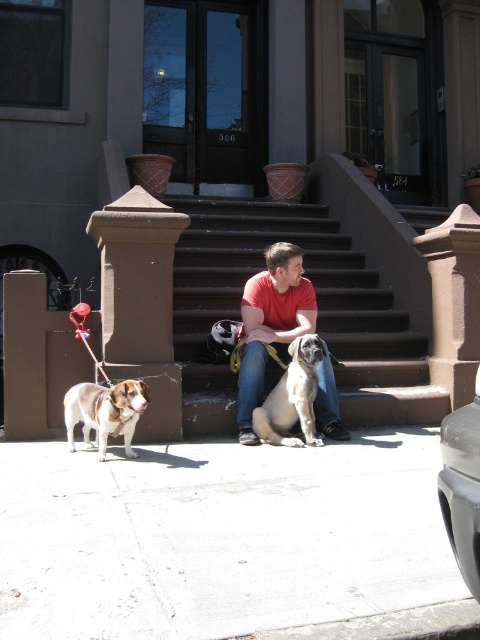
Who is taller, white concrete pavement at lower center or smooth gray dog at center?

smooth gray dog at center

Which is above, white concrete pavement at lower center or smooth gray dog at center?

smooth gray dog at center is above.

Is point (0, 616) in front of point (292, 388)?

Yes.

At what (x,y) coordinates should I click in order to perform the action: click on white concrete pavement at lower center. Please return your answer as a coordinate pair (x, y). Image resolution: width=480 pixels, height=640 pixels. Looking at the image, I should click on pos(227,541).

Is white concrete pavement at lower center thinner than brown stone stairs at center?

In fact, white concrete pavement at lower center might be wider than brown stone stairs at center.

Is white concrete pavement at lower center further to camera compared to brown stone stairs at center?

No, it is in front of brown stone stairs at center.

Does point (36, 458) come in front of point (240, 220)?

Yes, point (36, 458) is in front of point (240, 220).

Find the location of a particular element. Image resolution: width=480 pixels, height=640 pixels. white concrete pavement at lower center is located at coordinates (227, 541).

Which is more to the left, white concrete pavement at lower center or red matte shirt at center?

From the viewer's perspective, white concrete pavement at lower center appears more on the left side.

Who is more distant from viewer, (407, 461) or (274, 246)?

The point (274, 246) is behind.

Where is `white concrete pavement at lower center`? white concrete pavement at lower center is located at coordinates (227, 541).